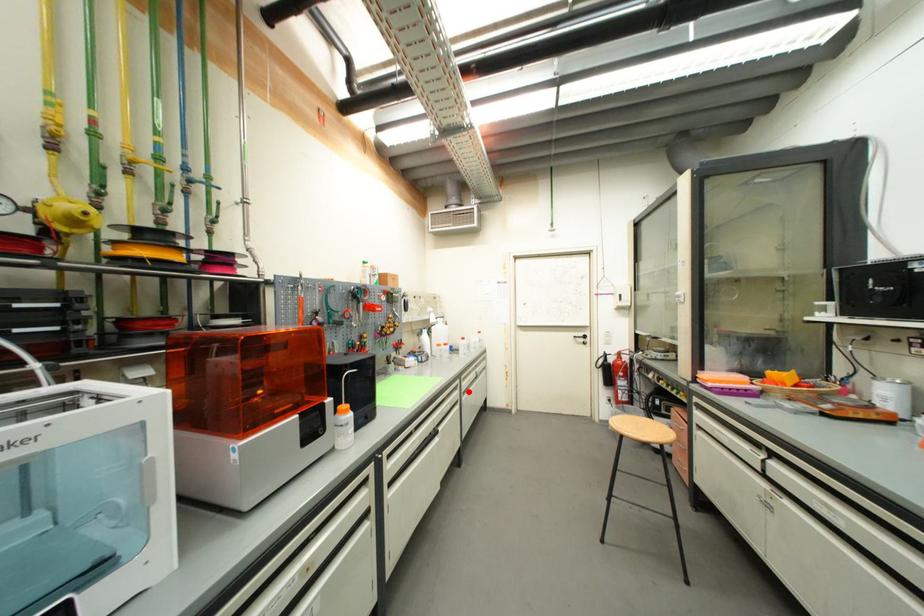
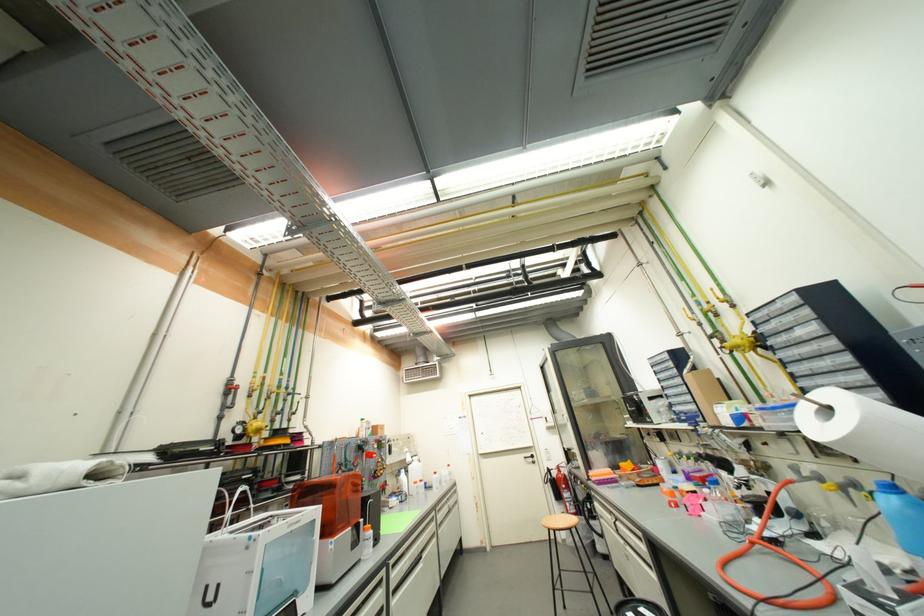
Where in the second image is the point corresponding to the highlighted location from the first image?

(444, 525)